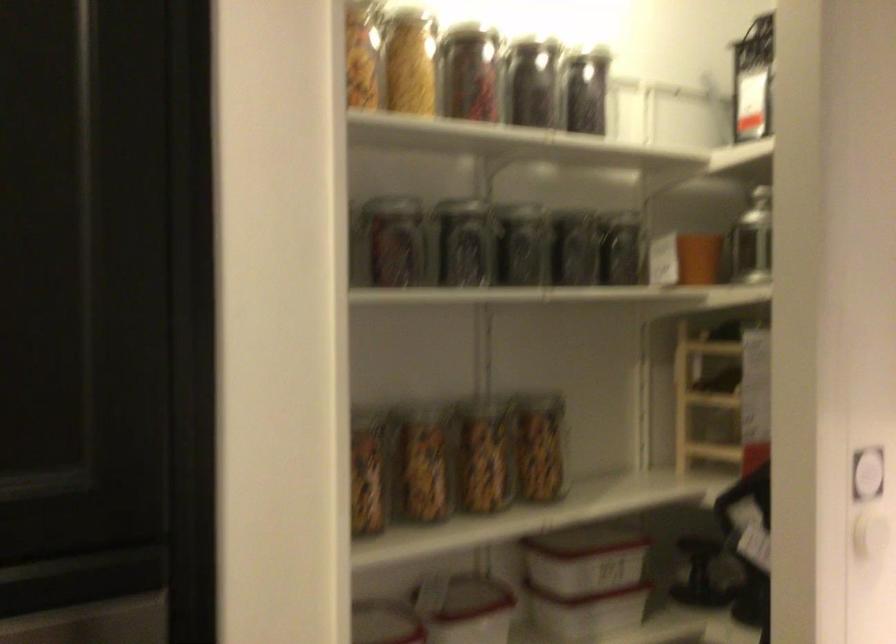
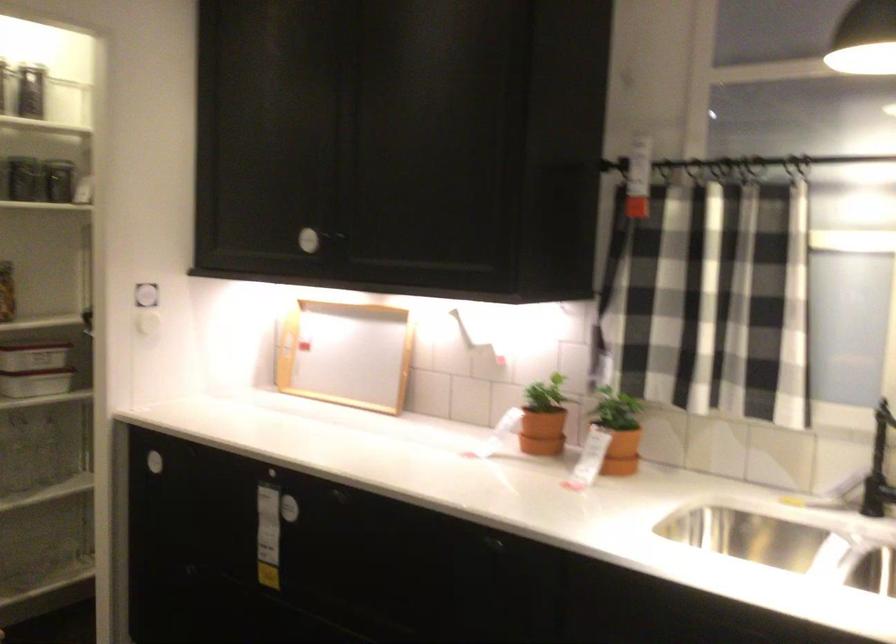
Locate, in the second image, the point that corresponds to (x=591, y=261) in the first image.

(31, 187)